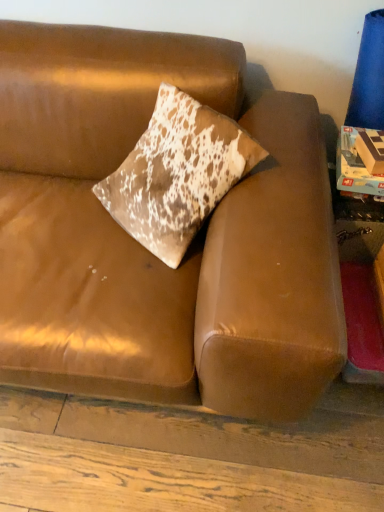
Describe the element at coordinates (145, 250) in the screenshot. This screenshot has height=512, width=384. I see `brown leather couch at center` at that location.

Identify the location of brown leather couch at center. The image size is (384, 512). (145, 250).

In order to face brown leather couch at center, should I rotate leftwards or rightwards?

To face it directly, rotate left by 11.534 degrees.

I want to click on brown leather couch at center, so click(145, 250).